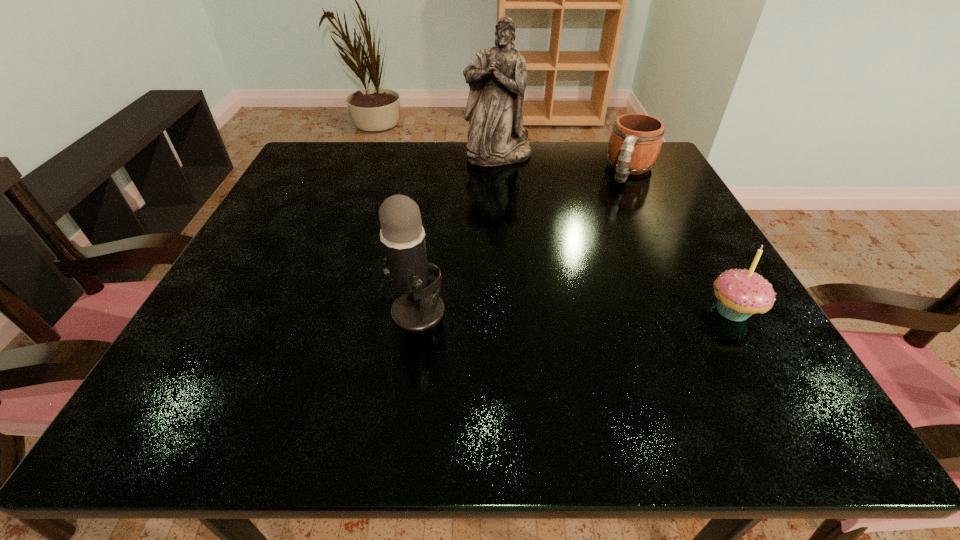
I want to click on object that is the closest to the mug, so click(x=497, y=80).

The height and width of the screenshot is (540, 960). Find the location of `vacant space that satisfies the following two spatial constraints: 1. on the front side of the tallest object; 2. on the left side of the cupcake`. vacant space that satisfies the following two spatial constraints: 1. on the front side of the tallest object; 2. on the left side of the cupcake is located at coordinates click(x=507, y=310).

I want to click on free location that satisfies the following two spatial constraints: 1. on the front side of the cupcake; 2. on the left side of the mug, so click(700, 310).

Where is `vacant area in the image that satisfies the following two spatial constraints: 1. on the front side of the tallest object; 2. on the left side of the mug`? vacant area in the image that satisfies the following two spatial constraints: 1. on the front side of the tallest object; 2. on the left side of the mug is located at coordinates (498, 171).

What are the coordinates of `free space that satisfies the following two spatial constraints: 1. on the back side of the leftmost object; 2. on the left side of the tallest object` in the screenshot? It's located at (440, 155).

The width and height of the screenshot is (960, 540). I want to click on free space that satisfies the following two spatial constraints: 1. on the back side of the second tallest object; 2. on the right side of the cupcake, so click(418, 310).

This screenshot has width=960, height=540. What are the coordinates of `free location that satisfies the following two spatial constraints: 1. on the back side of the cupcake; 2. on the right side of the leftmost object` in the screenshot? It's located at (418, 310).